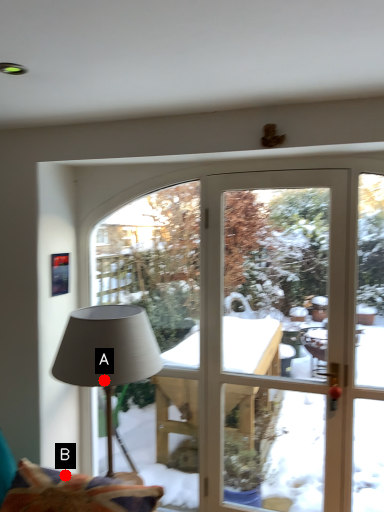
Question: Two points are circled on the image, labeled by A and B beside each circle. Which point appears closest to the camera in this image?

Choices:
 (A) A is closer
 (B) B is closer

Answer: (B)